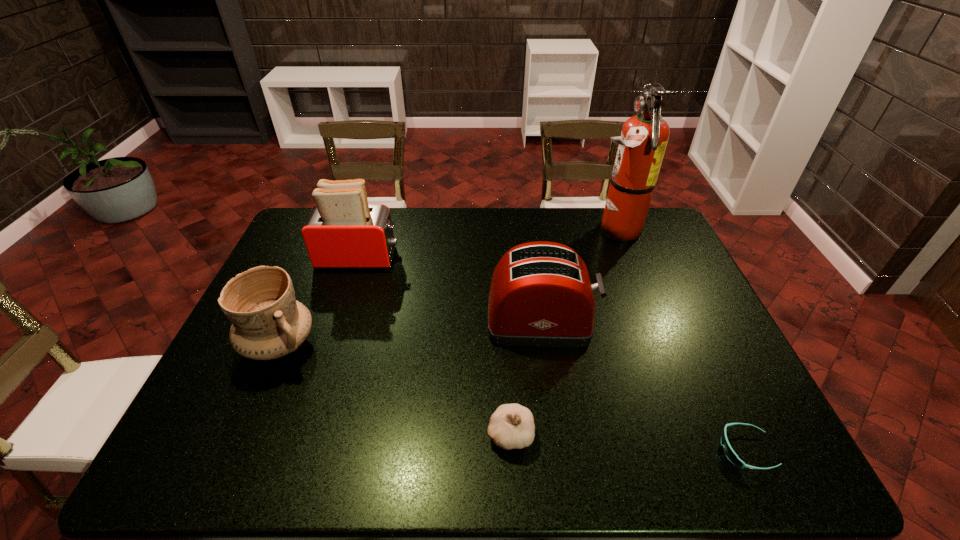
The height and width of the screenshot is (540, 960). Find the location of `the tallest object`. the tallest object is located at coordinates (644, 137).

Identify the location of the left toaster. The image size is (960, 540). (342, 231).

You are a GUI agent. You are given a task and a screenshot of the screen. Output one action in this format:
    pyautogui.click(x=<x>, y=<y>)
    Task: Click on the farther toaster
    The width and height of the screenshot is (960, 540).
    Given the screenshot: What is the action you would take?
    pyautogui.click(x=342, y=231)

Where is `the nearer toaster`? the nearer toaster is located at coordinates (541, 295).

Find the location of a particular element. the right toaster is located at coordinates click(x=541, y=295).

Find the location of `pottery`. pottery is located at coordinates (268, 323).

The height and width of the screenshot is (540, 960). What are the coordinates of `garlic` in the screenshot? It's located at click(511, 426).

You are a GUI agent. You are given a task and a screenshot of the screen. Output one action in this format:
    pyautogui.click(x=<x>, y=<y>)
    Task: Click on the sunglasses
    
    Given the screenshot: What is the action you would take?
    tap(729, 452)

Where is `vacant space located from the nozzle of the tallest object`? vacant space located from the nozzle of the tallest object is located at coordinates (493, 230).

The image size is (960, 540). What are the coordinates of `free space located 0.150m from the nozzle of the tallest object` in the screenshot? It's located at (546, 230).